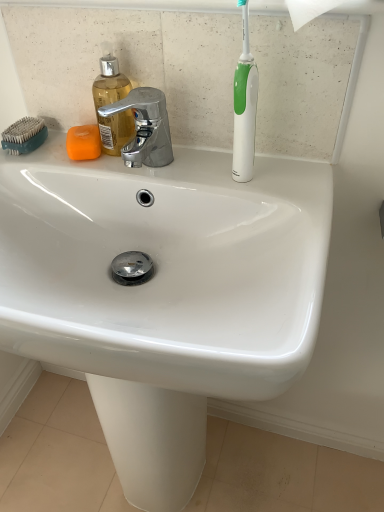
Question: Can you confirm if orange matte soap at upper left is shorter than white glossy toothbrush at upper right?

Choices:
 (A) no
 (B) yes

Answer: (B)

Question: Could you tell me if orange matte soap at upper left is turned towards white glossy toothbrush at upper right?

Choices:
 (A) no
 (B) yes

Answer: (A)

Question: Is white glossy toothbrush at upper right a part of orange matte soap at upper left?

Choices:
 (A) no
 (B) yes

Answer: (A)

Question: Is orange matte soap at upper left turned away from white glossy toothbrush at upper right?

Choices:
 (A) yes
 (B) no

Answer: (B)

Question: Considering the relative sizes of orange matte soap at upper left and white glossy toothbrush at upper right in the image provided, is orange matte soap at upper left smaller than white glossy toothbrush at upper right?

Choices:
 (A) no
 (B) yes

Answer: (B)

Question: Looking at the image, does white glossy toothbrush at upper right seem bigger or smaller compared to white glossy sink at center?

Choices:
 (A) big
 (B) small

Answer: (B)

Question: In the image, is white glossy toothbrush at upper right positioned in front of or behind white glossy sink at center?

Choices:
 (A) behind
 (B) front

Answer: (A)

Question: Is white glossy toothbrush at upper right inside the boundaries of white glossy sink at center, or outside?

Choices:
 (A) inside
 (B) outside

Answer: (B)

Question: Is point (236, 116) positioned closer to the camera than point (112, 306)?

Choices:
 (A) farther
 (B) closer

Answer: (A)

Question: From a real-world perspective, is white glossy toothbrush at upper right above or below orange matte soap at upper left?

Choices:
 (A) below
 (B) above

Answer: (B)

Question: From the image's perspective, relative to orange matte soap at upper left, is white glossy toothbrush at upper right above or below?

Choices:
 (A) above
 (B) below

Answer: (A)

Question: Considering the positions of white glossy toothbrush at upper right and orange matte soap at upper left in the image, is white glossy toothbrush at upper right taller or shorter than orange matte soap at upper left?

Choices:
 (A) tall
 (B) short

Answer: (A)

Question: In the image, is white glossy toothbrush at upper right on the left side or the right side of orange matte soap at upper left?

Choices:
 (A) left
 (B) right

Answer: (B)

Question: Visually, is teal plastic comb at upper left positioned to the left or to the right of polished chrome faucet at upper center?

Choices:
 (A) left
 (B) right

Answer: (A)

Question: Considering their positions, is teal plastic comb at upper left located in front of or behind polished chrome faucet at upper center?

Choices:
 (A) behind
 (B) front

Answer: (A)